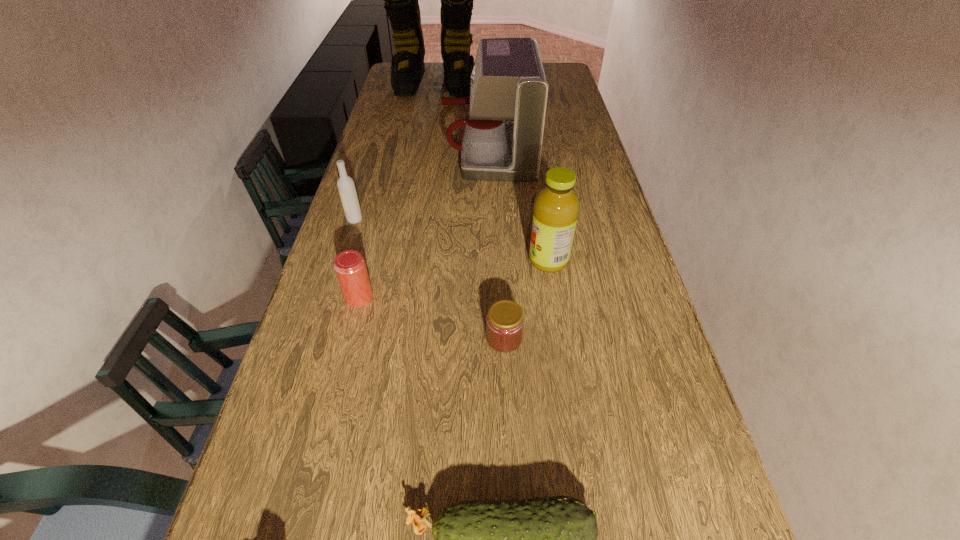
Where is `vacant area between the tallest object and the fifth nearest object`? The width and height of the screenshot is (960, 540). vacant area between the tallest object and the fifth nearest object is located at coordinates (395, 151).

Identify the location of empty location between the sixth farthest object and the coffee maker. The height and width of the screenshot is (540, 960). (496, 246).

Image resolution: width=960 pixels, height=540 pixels. I want to click on vacant area that lies between the jam and the second farthest object, so click(496, 246).

Select which object is the second closest to the sixth nearest object. Please provide its 2D coordinates. Your answer should be formatted as a tuple, i.e. [(x, y)], where the tuple contains the x and y coordinates of a point satisfying the conditions above.

[(345, 184)]

Select which object appears as the third closest to the jam. Please provide its 2D coordinates. Your answer should be formatted as a tuple, i.e. [(x, y)], where the tuple contains the x and y coordinates of a point satisfying the conditions above.

[(553, 539)]